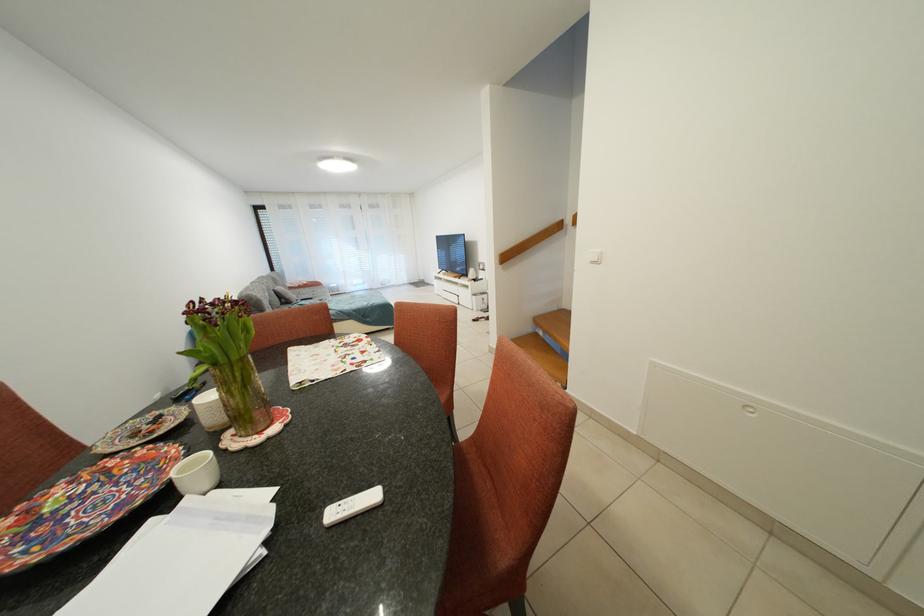
What do you see at coordinates (361, 308) in the screenshot? I see `the sofa sitting surface` at bounding box center [361, 308].